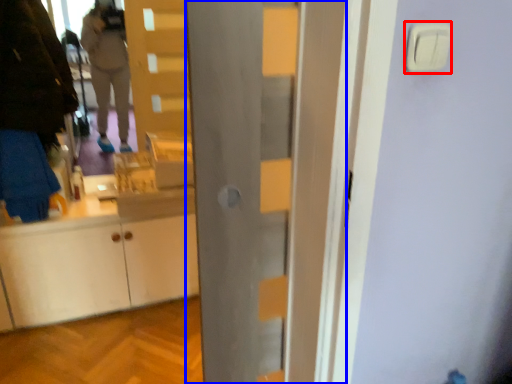
Question: Among these objects, which one is farthest to the camera, light switch (highlighted by a red box) or door (highlighted by a blue box)?

Choices:
 (A) light switch
 (B) door

Answer: (B)